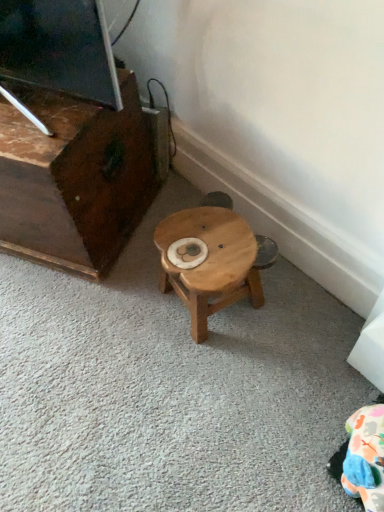
What do you see at coordinates (74, 178) in the screenshot? Image resolution: width=384 pixels, height=512 pixels. I see `dark brown wood entertainment center at left` at bounding box center [74, 178].

What is the approximate height of dark brown wood entertainment center at left?

It is 17.36 inches.

Identify the location of dark brown wood entertainment center at left. The image size is (384, 512). (74, 178).

The image size is (384, 512). In order to click on wooden stool at center in this screenshot , I will do `click(209, 262)`.

The width and height of the screenshot is (384, 512). What do you see at coordinates (209, 262) in the screenshot? I see `wooden stool at center` at bounding box center [209, 262].

At what (x,y) coordinates should I click in order to perform the action: click on dark brown wood entertainment center at left. Please return your answer as a coordinate pair (x, y). Image resolution: width=384 pixels, height=512 pixels. Looking at the image, I should click on (74, 178).

Considering the relative positions of wooden stool at center and dark brown wood entertainment center at left in the image provided, is wooden stool at center to the left or to the right of dark brown wood entertainment center at left?

Clearly, wooden stool at center is on the right of dark brown wood entertainment center at left in the image.

Who is more distant, wooden stool at center or dark brown wood entertainment center at left?

wooden stool at center is more distant.

Which is more distant, (236, 289) or (87, 242)?

The point (87, 242) is more distant.

From the image's perspective, is wooden stool at center positioned above or below dark brown wood entertainment center at left?

wooden stool at center is below dark brown wood entertainment center at left.

In the scene shown: From a real-world perspective, is wooden stool at center over dark brown wood entertainment center at left?

Incorrect, from a real-world perspective, wooden stool at center is lower than dark brown wood entertainment center at left.

Is wooden stool at center wider or thinner than dark brown wood entertainment center at left?

wooden stool at center is thinner than dark brown wood entertainment center at left.

In the scene shown: Is wooden stool at center shorter than dark brown wood entertainment center at left?

Yes, wooden stool at center is shorter than dark brown wood entertainment center at left.

Is wooden stool at center smaller than dark brown wood entertainment center at left?

Correct, wooden stool at center occupies less space than dark brown wood entertainment center at left.

In the scene shown: Is wooden stool at center not inside dark brown wood entertainment center at left?

Yes.

Are wooden stool at center and dark brown wood entertainment center at left far apart?

No, wooden stool at center is not far away from dark brown wood entertainment center at left.

In the scene shown: Is wooden stool at center facing away from dark brown wood entertainment center at left?

wooden stool at center does not have its back to dark brown wood entertainment center at left.

In order to click on stool that is on the right side of dark brown wood entertainment center at left in this screenshot , I will do [x=209, y=262].

Would you say dark brown wood entertainment center at left is to the left or to the right of wooden stool at center in the picture?

Based on their positions, dark brown wood entertainment center at left is located to the left of wooden stool at center.

Which object is further away from the camera, dark brown wood entertainment center at left or wooden stool at center?

wooden stool at center is behind.

Which point is more forward, (53, 191) or (164, 224)?

Positioned in front is point (53, 191).

From the image's perspective, is dark brown wood entertainment center at left above or below wooden stool at center?

dark brown wood entertainment center at left is above wooden stool at center.

From a real-world perspective, which is physically below, dark brown wood entertainment center at left or wooden stool at center?

wooden stool at center.

Considering the relative sizes of dark brown wood entertainment center at left and wooden stool at center in the image provided, is dark brown wood entertainment center at left wider than wooden stool at center?

Correct, the width of dark brown wood entertainment center at left exceeds that of wooden stool at center.

Does dark brown wood entertainment center at left have a lesser height compared to wooden stool at center?

No, dark brown wood entertainment center at left is not shorter than wooden stool at center.

Between dark brown wood entertainment center at left and wooden stool at center, which one has smaller size?

wooden stool at center is smaller.

Do you think dark brown wood entertainment center at left is within wooden stool at center, or outside of it?

dark brown wood entertainment center at left is not enclosed by wooden stool at center.

Is the surface of dark brown wood entertainment center at left in direct contact with wooden stool at center?

No, dark brown wood entertainment center at left is not in contact with wooden stool at center.

Is dark brown wood entertainment center at left turned away from wooden stool at center?

No, dark brown wood entertainment center at left is not facing the opposite direction of wooden stool at center.

How many degrees apart are the facing directions of dark brown wood entertainment center at left and wooden stool at center?

The angle between the facing direction of dark brown wood entertainment center at left and the facing direction of wooden stool at center is 32.8 degrees.

Where is `furniture on the left side of wooden stool at center`? This screenshot has height=512, width=384. furniture on the left side of wooden stool at center is located at coordinates (74, 178).

Image resolution: width=384 pixels, height=512 pixels. What are the coordinates of `furniture to the left of wooden stool at center` in the screenshot? It's located at (74, 178).

Where is `stool below the dark brown wood entertainment center at left (from the image's perspective)`? The width and height of the screenshot is (384, 512). stool below the dark brown wood entertainment center at left (from the image's perspective) is located at coordinates (209, 262).